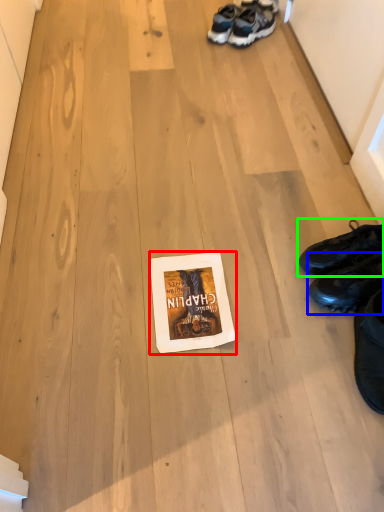
Question: Considering the real-world distances, which object is closest to paperback book (highlighted by a red box)? footwear (highlighted by a blue box) or footwear (highlighted by a green box).

Choices:
 (A) footwear
 (B) footwear

Answer: (A)